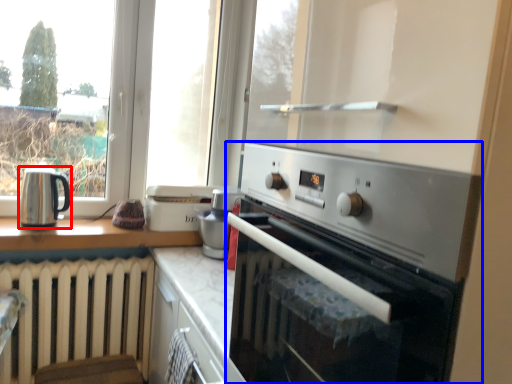
Question: Among these objects, which one is nearest to the camera, kitchen appliance (highlighted by a red box) or home appliance (highlighted by a blue box)?

Choices:
 (A) kitchen appliance
 (B) home appliance

Answer: (B)